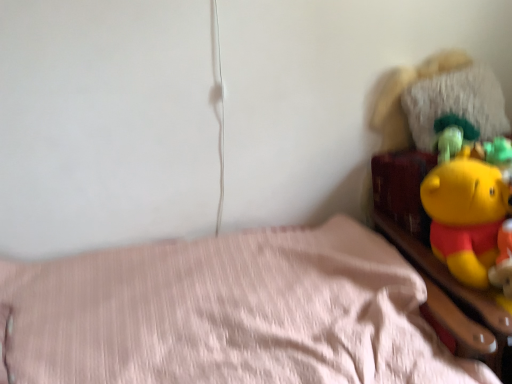
Question: Is the depth of fuzzy white pillow at upper right less than that of pink fabric bed at lower left?

Choices:
 (A) yes
 (B) no

Answer: (B)

Question: From the image's perspective, is fuzzy white pillow at upper right on pink fabric bed at lower left?

Choices:
 (A) yes
 (B) no

Answer: (A)

Question: Can you confirm if fuzzy white pillow at upper right is shorter than pink fabric bed at lower left?

Choices:
 (A) yes
 (B) no

Answer: (A)

Question: Is fuzzy white pillow at upper right at the right side of pink fabric bed at lower left?

Choices:
 (A) yes
 (B) no

Answer: (A)

Question: Is fuzzy white pillow at upper right next to pink fabric bed at lower left and touching it?

Choices:
 (A) yes
 (B) no

Answer: (B)

Question: Is pink fabric bed at lower left taller or shorter than yellow plush toy at upper right?

Choices:
 (A) tall
 (B) short

Answer: (A)

Question: Is pink fabric bed at lower left wider or thinner than yellow plush toy at upper right?

Choices:
 (A) wide
 (B) thin

Answer: (A)

Question: From a real-world perspective, is pink fabric bed at lower left physically located above or below yellow plush toy at upper right?

Choices:
 (A) above
 (B) below

Answer: (B)

Question: Is pink fabric bed at lower left inside or outside of yellow plush toy at upper right?

Choices:
 (A) inside
 (B) outside

Answer: (B)

Question: From a real-world perspective, is yellow plush toy at upper right positioned above or below fuzzy white pillow at upper right?

Choices:
 (A) below
 (B) above

Answer: (A)

Question: Is yellow plush toy at upper right wider or thinner than fuzzy white pillow at upper right?

Choices:
 (A) thin
 (B) wide

Answer: (B)

Question: Is yellow plush toy at upper right taller or shorter than fuzzy white pillow at upper right?

Choices:
 (A) short
 (B) tall

Answer: (B)

Question: Does point (408, 100) appear closer or farther from the camera than point (501, 110)?

Choices:
 (A) farther
 (B) closer

Answer: (B)

Question: Would you say fuzzy white pillow at upper right is to the left or to the right of pink fabric bed at lower left in the picture?

Choices:
 (A) right
 (B) left

Answer: (A)

Question: From the image's perspective, is fuzzy white pillow at upper right located above or below pink fabric bed at lower left?

Choices:
 (A) above
 (B) below

Answer: (A)